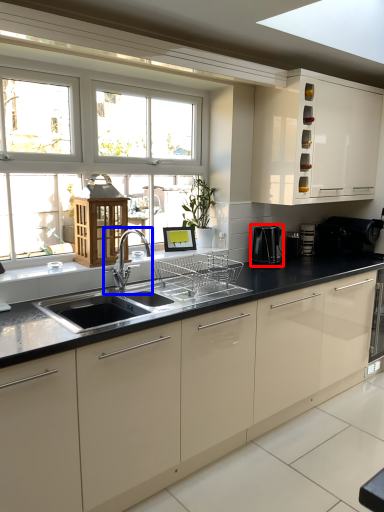
Question: Which of the following is the closest to the observer, coffee machine (highlighted by a red box) or tap (highlighted by a blue box)?

Choices:
 (A) coffee machine
 (B) tap

Answer: (B)